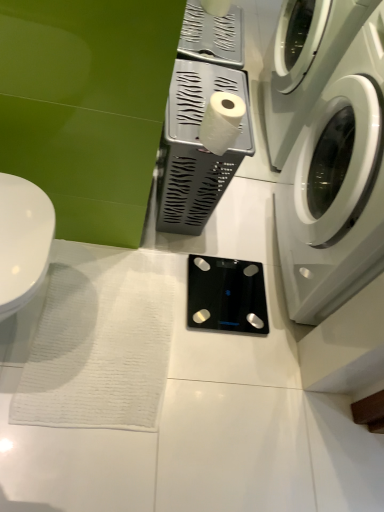
Identify the location of unoccupied space behind black glass scale at center, acting as the 2th appliance starting from the top. The height and width of the screenshot is (512, 384). (240, 236).